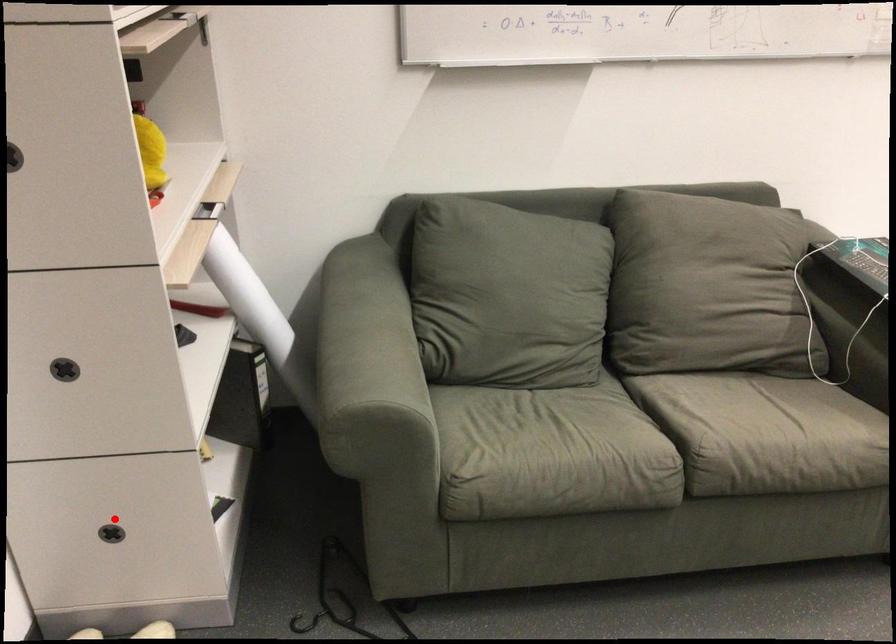
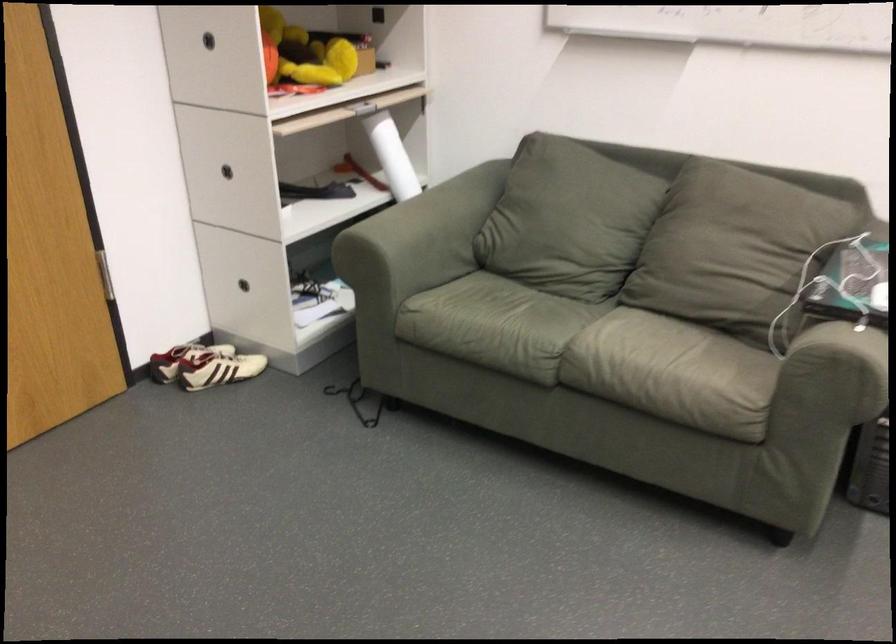
Find the pixel in the second image that matches the highlighted location in the first image.

(252, 283)